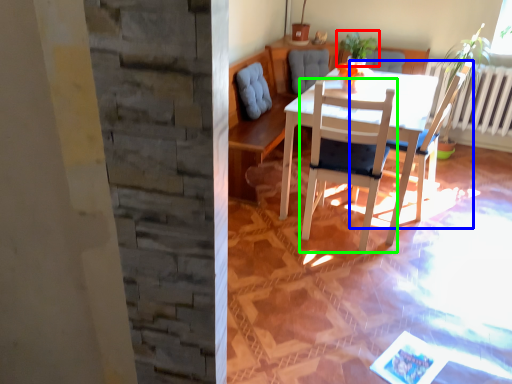
Question: Which object is positioned closest to houseplant (highlighted by a red box)? Select from chair (highlighted by a blue box) and chair (highlighted by a green box).

Choices:
 (A) chair
 (B) chair

Answer: (A)